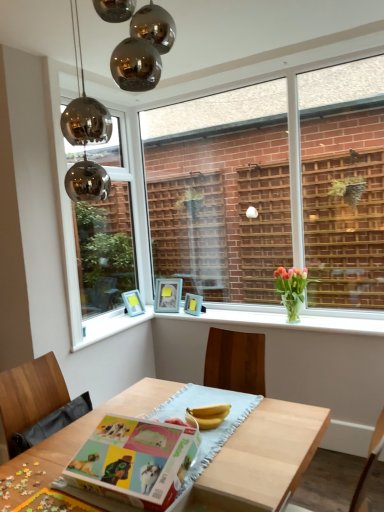
Question: Considering the relative sizes of white glossy window sill at center and metallic glass window at upper left, which ranks as the 1th window in left-to-right order, in the image provided, is white glossy window sill at center wider than metallic glass window at upper left, which ranks as the 1th window in left-to-right order,?

Choices:
 (A) yes
 (B) no

Answer: (A)

Question: From the image's perspective, is white glossy window sill at center over metallic glass window at upper left, acting as the second window starting from the right?

Choices:
 (A) no
 (B) yes

Answer: (A)

Question: Is white glossy window sill at center behind metallic glass window at upper left, which ranks as the 1th window in left-to-right order?

Choices:
 (A) no
 (B) yes

Answer: (A)

Question: Is white glossy window sill at center far away from metallic glass window at upper left, acting as the second window starting from the right?

Choices:
 (A) yes
 (B) no

Answer: (A)

Question: Is white glossy window sill at center at the left side of metallic glass window at upper left, which ranks as the 1th window in left-to-right order?

Choices:
 (A) no
 (B) yes

Answer: (A)

Question: From their relative heights in the image, would you say clear glass window at center, which is counted as the second window, starting from the left, is taller or shorter than matte blue picture frame at upper left, placed as the 3th picture frame when sorted from right to left?

Choices:
 (A) tall
 (B) short

Answer: (A)

Question: In terms of size, does clear glass window at center, which is counted as the second window, starting from the left, appear bigger or smaller than matte blue picture frame at upper left, placed as the first picture frame when sorted from left to right?

Choices:
 (A) big
 (B) small

Answer: (A)

Question: From a real-world perspective, is clear glass window at center, which ranks as the first window in right-to-left order, above or below matte blue picture frame at upper left, placed as the first picture frame when sorted from left to right?

Choices:
 (A) below
 (B) above

Answer: (B)

Question: Is point (157, 245) closer or farther from the camera than point (132, 308)?

Choices:
 (A) closer
 (B) farther

Answer: (B)

Question: In terms of width, does matte blue picture frame at upper center, positioned as the 2th picture frame in right-to-left order, look wider or thinner when compared to yellow matte bananas at center?

Choices:
 (A) wide
 (B) thin

Answer: (A)

Question: From the image's perspective, is matte blue picture frame at upper center, the 2th picture frame from the left, located above or below yellow matte bananas at center?

Choices:
 (A) above
 (B) below

Answer: (A)

Question: Considering the positions of matte blue picture frame at upper center, the 2th picture frame from the left, and yellow matte bananas at center in the image, is matte blue picture frame at upper center, the 2th picture frame from the left, bigger or smaller than yellow matte bananas at center?

Choices:
 (A) big
 (B) small

Answer: (A)

Question: Which is correct: matte blue picture frame at upper center, the 2th picture frame from the left, is inside yellow matte bananas at center, or outside of it?

Choices:
 (A) outside
 (B) inside

Answer: (A)

Question: Looking at their shapes, would you say yellow matte bananas at center is wider or thinner than matte paperboard book at center?

Choices:
 (A) wide
 (B) thin

Answer: (B)

Question: Relative to matte paperboard book at center, is yellow matte bananas at center in front or behind?

Choices:
 (A) behind
 (B) front

Answer: (A)